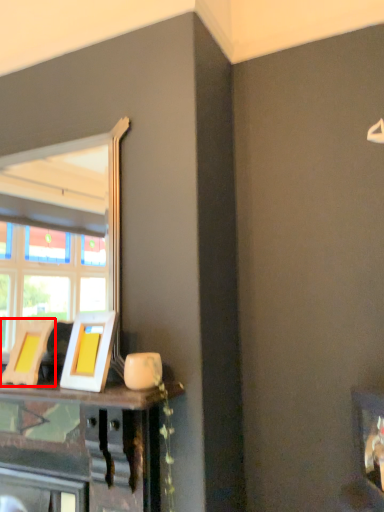
Question: From the image's perspective, where is picture frame (annotated by the red box) located relative to picture frame?

Choices:
 (A) below
 (B) above

Answer: (A)